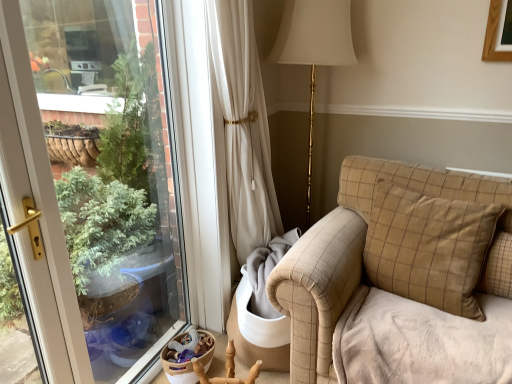
Question: Does wooden armchair at lower center have a smaller size compared to beige checkered couch at right?

Choices:
 (A) yes
 (B) no

Answer: (A)

Question: Considering the relative sizes of wooden armchair at lower center and beige checkered couch at right in the image provided, is wooden armchair at lower center taller than beige checkered couch at right?

Choices:
 (A) yes
 (B) no

Answer: (B)

Question: Is the position of wooden armchair at lower center less distant than that of beige checkered couch at right?

Choices:
 (A) no
 (B) yes

Answer: (A)

Question: Does wooden armchair at lower center appear on the left side of beige checkered couch at right?

Choices:
 (A) yes
 (B) no

Answer: (A)

Question: Is wooden armchair at lower center outside beige checkered couch at right?

Choices:
 (A) yes
 (B) no

Answer: (A)

Question: From a real-world perspective, is beige checkered pillow at right physically located above or below wooden armchair at lower center?

Choices:
 (A) below
 (B) above

Answer: (B)

Question: Considering the relative positions of beige checkered pillow at right and wooden armchair at lower center in the image provided, is beige checkered pillow at right to the left or to the right of wooden armchair at lower center?

Choices:
 (A) right
 (B) left

Answer: (A)

Question: Relative to wooden armchair at lower center, is beige checkered pillow at right in front or behind?

Choices:
 (A) front
 (B) behind

Answer: (A)

Question: Is beige checkered pillow at right wider or thinner than wooden armchair at lower center?

Choices:
 (A) wide
 (B) thin

Answer: (B)

Question: Considering their positions, is beige checkered pillow at right located in front of or behind beige checkered couch at right?

Choices:
 (A) front
 (B) behind

Answer: (B)

Question: In terms of size, does beige checkered pillow at right appear bigger or smaller than beige checkered couch at right?

Choices:
 (A) small
 (B) big

Answer: (A)

Question: Based on their positions, is beige checkered pillow at right located to the left or right of beige checkered couch at right?

Choices:
 (A) right
 (B) left

Answer: (A)

Question: Considering the positions of point (495, 271) and point (320, 362), is point (495, 271) closer or farther from the camera than point (320, 362)?

Choices:
 (A) closer
 (B) farther

Answer: (B)

Question: Considering the positions of beige checkered couch at right and wooden armchair at lower center in the image, is beige checkered couch at right wider or thinner than wooden armchair at lower center?

Choices:
 (A) thin
 (B) wide

Answer: (B)

Question: Is beige checkered couch at right inside or outside of wooden armchair at lower center?

Choices:
 (A) inside
 (B) outside

Answer: (B)